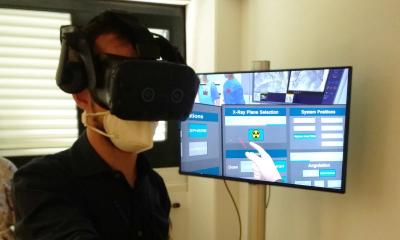
Locate an element on the screen. Image resolution: width=400 pixels, height=240 pixels. wall behind tv to the right is located at coordinates (376, 135).